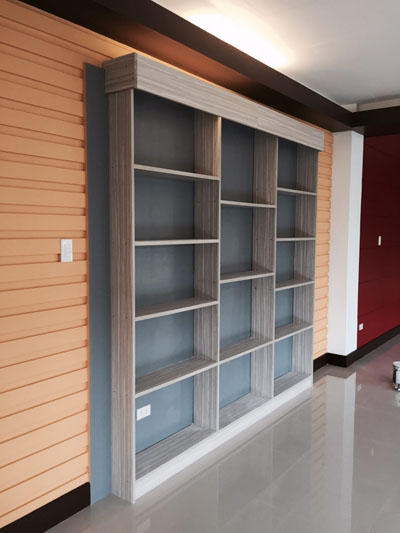
The width and height of the screenshot is (400, 533). In order to click on white column in this screenshot , I will do `click(348, 226)`.